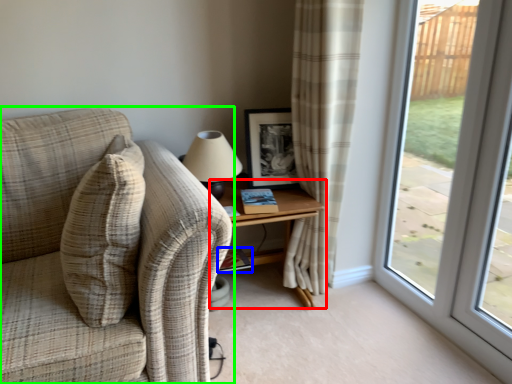
Question: Considering the real-world distances, which object is farthest from table (highlighted by a red box)? book (highlighted by a blue box) or studio couch (highlighted by a green box)?

Choices:
 (A) book
 (B) studio couch

Answer: (B)